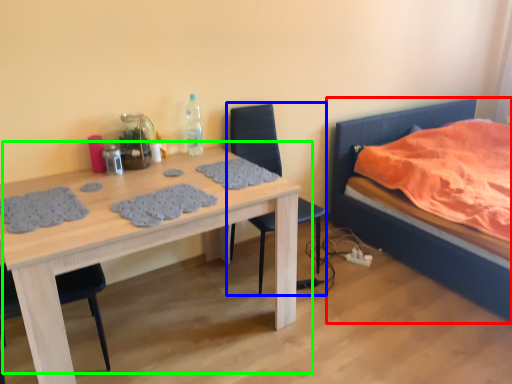
Question: Considering the real-world distances, which object is farthest from bed (highlighted by a red box)? chair (highlighted by a blue box) or table (highlighted by a green box)?

Choices:
 (A) chair
 (B) table

Answer: (B)